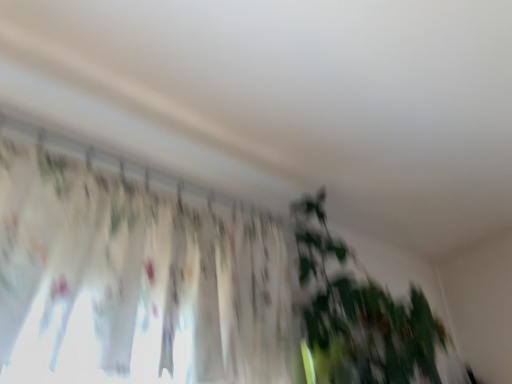
Based on the photo, in order to face green leafy plant at center, should I rotate leftwards or rightwards?

A 12.782 degree turn to the right will do.

What do you see at coordinates (360, 315) in the screenshot? I see `green leafy plant at center` at bounding box center [360, 315].

Locate an element on the screen. This screenshot has width=512, height=384. green leafy plant at center is located at coordinates (360, 315).

The height and width of the screenshot is (384, 512). What are the coordinates of `green leafy plant at center` in the screenshot? It's located at pos(360,315).